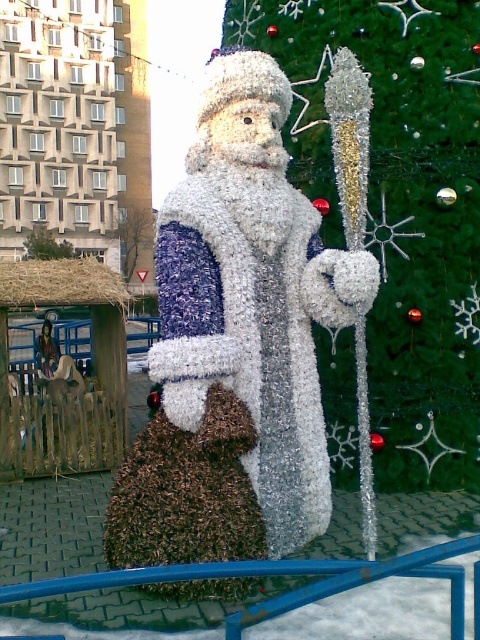
Who is lower down, shiny metallic santa claus at center or green shiny christmas tree at center?

shiny metallic santa claus at center is lower down.

Can you confirm if shiny metallic santa claus at center is positioned to the left of green shiny christmas tree at center?

Yes, shiny metallic santa claus at center is to the left of green shiny christmas tree at center.

Identify the location of shiny metallic santa claus at center. click(x=236, y=342).

Is point (207, 500) farther from viewer compared to point (476, 541)?

Yes.

Who is positioned more to the right, shiny metallic santa claus at center or blue metallic rail at center?

Positioned to the right is blue metallic rail at center.

Where is `shiny metallic santa claus at center`? Image resolution: width=480 pixels, height=640 pixels. shiny metallic santa claus at center is located at coordinates 236,342.

This screenshot has height=640, width=480. I want to click on shiny metallic santa claus at center, so click(236, 342).

Which is above, green shiny christmas tree at center or blue metallic rail at center?

green shiny christmas tree at center is above.

Locate an element on the screen. This screenshot has width=480, height=640. green shiny christmas tree at center is located at coordinates (397, 205).